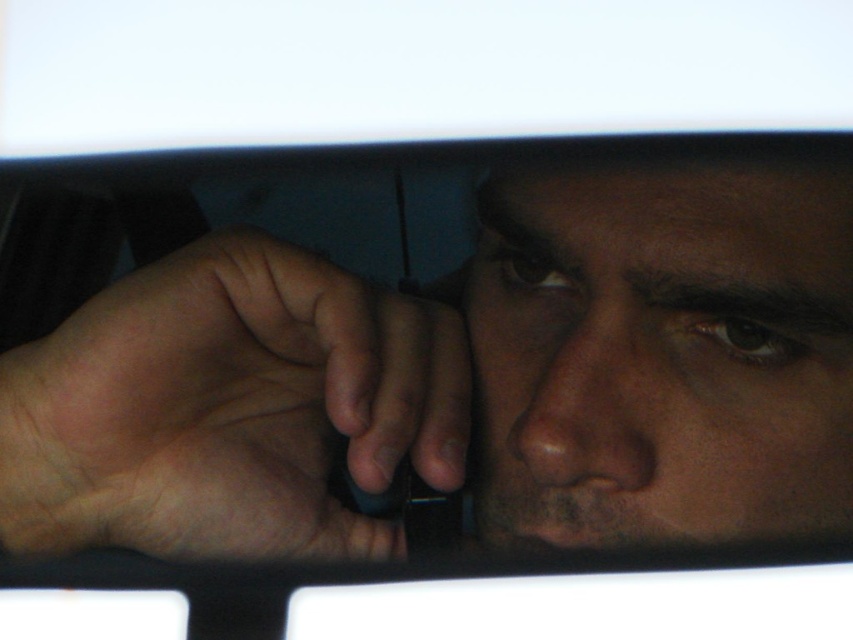
Does matte black phone at center have a greater width compared to sleek black phone at lower left?

Indeed, matte black phone at center has a greater width compared to sleek black phone at lower left.

Which is above, matte black phone at center or sleek black phone at lower left?

matte black phone at center

Is point (210, 483) more distant than point (189, 284)?

Yes, it is.

Identify the location of matte black phone at center. (462, 378).

Who is positioned more to the left, matte black phone at center or dry skin nose at center?

matte black phone at center

The width and height of the screenshot is (853, 640). I want to click on matte black phone at center, so click(462, 378).

Measure the distance between matte black phone at center and camera.

A distance of 20.77 inches exists between matte black phone at center and camera.

The width and height of the screenshot is (853, 640). I want to click on matte black phone at center, so click(462, 378).

Based on the photo, is sleek black phone at lower left positioned at the back of dry skin nose at center?

That is False.

At what (x,y) coordinates should I click in order to perform the action: click on sleek black phone at lower left. Please return your answer as a coordinate pair (x, y). The image size is (853, 640). Looking at the image, I should click on (228, 410).